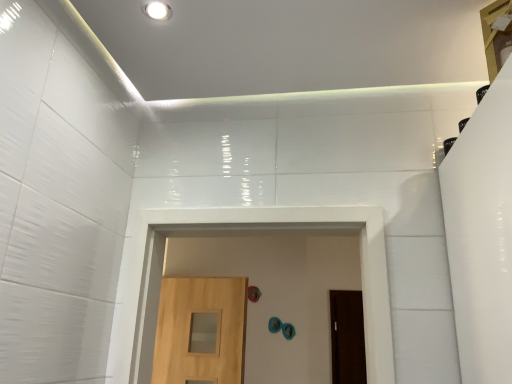
Question: Which direction should I rotate to look at white glossy recessed light at upper center?

Choices:
 (A) right
 (B) left

Answer: (B)

Question: Is brown matte door at center, the 2th door in the front-to-back sequence, inside light brown wood door at center, the first door from the front?

Choices:
 (A) no
 (B) yes

Answer: (A)

Question: Does light brown wood door at center, the first door from the front, have a smaller size compared to brown matte door at center, the first door in the right-to-left sequence?

Choices:
 (A) no
 (B) yes

Answer: (A)

Question: Is light brown wood door at center, positioned as the 2th door in right-to-left order, in contact with brown matte door at center, the first door in the right-to-left sequence?

Choices:
 (A) yes
 (B) no

Answer: (B)

Question: Could you tell me if light brown wood door at center, placed as the first door when sorted from left to right, is facing brown matte door at center, acting as the 1th door starting from the back?

Choices:
 (A) no
 (B) yes

Answer: (A)

Question: Is light brown wood door at center, arranged as the second door when viewed from the back, wider than brown matte door at center, the 2th door in the front-to-back sequence?

Choices:
 (A) no
 (B) yes

Answer: (B)

Question: Can you confirm if light brown wood door at center, positioned as the 2th door in right-to-left order, is taller than brown matte door at center, the 2th door in the front-to-back sequence?

Choices:
 (A) no
 (B) yes

Answer: (A)

Question: From the image's perspective, is white glossy recessed light at upper center on top of light brown wood door at center, arranged as the second door when viewed from the back?

Choices:
 (A) yes
 (B) no

Answer: (A)

Question: Is white glossy recessed light at upper center not near light brown wood door at center, arranged as the second door when viewed from the back?

Choices:
 (A) yes
 (B) no

Answer: (A)

Question: Is white glossy recessed light at upper center wider than light brown wood door at center, positioned as the 2th door in right-to-left order?

Choices:
 (A) no
 (B) yes

Answer: (A)

Question: Is white glossy recessed light at upper center positioned in front of light brown wood door at center, positioned as the 2th door in right-to-left order?

Choices:
 (A) no
 (B) yes

Answer: (B)

Question: Is white glossy recessed light at upper center outside light brown wood door at center, positioned as the 2th door in right-to-left order?

Choices:
 (A) yes
 (B) no

Answer: (A)

Question: From the image's perspective, is white glossy recessed light at upper center located beneath light brown wood door at center, the first door from the front?

Choices:
 (A) no
 (B) yes

Answer: (A)

Question: From the image's perspective, is light brown wood door at center, positioned as the 2th door in right-to-left order, on white glossy recessed light at upper center?

Choices:
 (A) no
 (B) yes

Answer: (A)